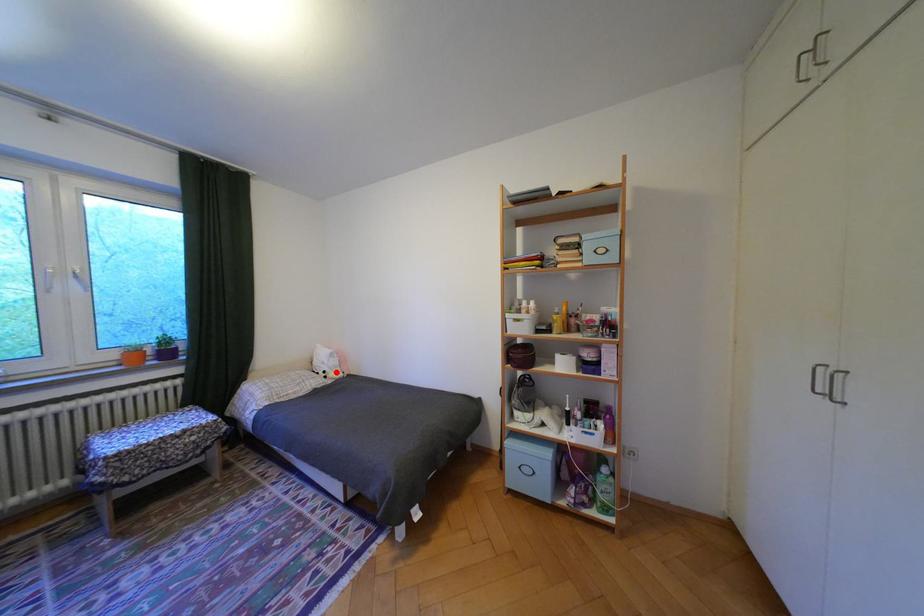
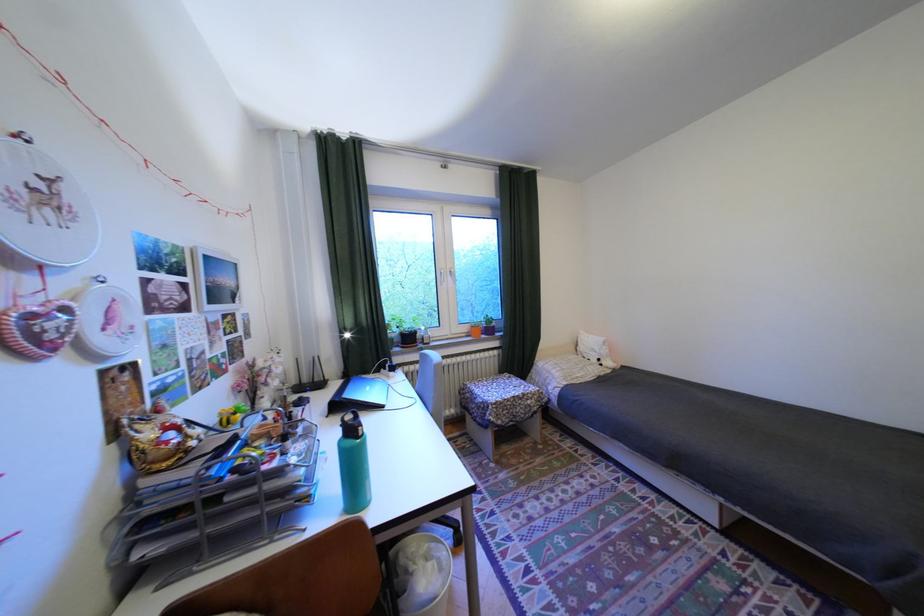
In the second image, find the point that corresponds to the highlighted location in the first image.

(611, 360)